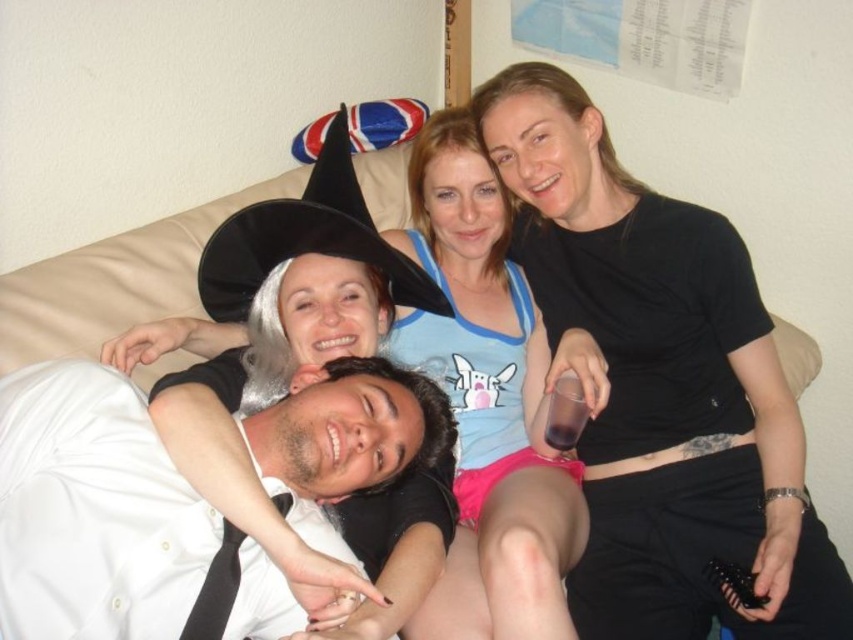
Does matte black witch hat at upper center appear on the right side of white glossy shirt at lower left?

Indeed, matte black witch hat at upper center is positioned on the right side of white glossy shirt at lower left.

Is matte black witch hat at upper center to the left of white glossy shirt at lower left from the viewer's perspective?

No, matte black witch hat at upper center is not to the left of white glossy shirt at lower left.

Does point (202, 262) come farther from viewer compared to point (10, 385)?

Yes, it is.

Where is `matte black witch hat at upper center`? The image size is (853, 640). matte black witch hat at upper center is located at coordinates (299, 364).

Which of these two, black matte shirt at upper right or matte black witch hat at upper center, stands shorter?

With less height is matte black witch hat at upper center.

Does point (601, 442) come in front of point (373, 512)?

No, (601, 442) is further to viewer.

Between point (672, 611) and point (245, 509), which one is positioned in front?

Point (245, 509) is in front.

Locate an element on the screen. The height and width of the screenshot is (640, 853). black matte shirt at upper right is located at coordinates pos(660,385).

Can you confirm if white glossy shirt at lower left is positioned to the right of light blue cotton tank top at center?

No, white glossy shirt at lower left is not to the right of light blue cotton tank top at center.

Who is taller, white glossy shirt at lower left or light blue cotton tank top at center?

With more height is light blue cotton tank top at center.

Who is more forward, (140, 477) or (456, 484)?

Point (140, 477) is in front.

Image resolution: width=853 pixels, height=640 pixels. I want to click on white glossy shirt at lower left, so click(x=91, y=513).